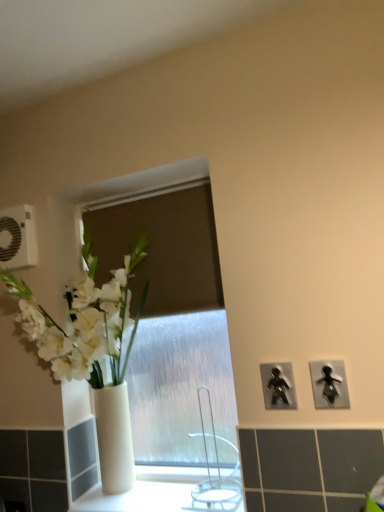
This screenshot has width=384, height=512. Describe the element at coordinates (91, 350) in the screenshot. I see `white glossy vase at left` at that location.

Where is `white glossy vase at left`? Image resolution: width=384 pixels, height=512 pixels. white glossy vase at left is located at coordinates (91, 350).

What do you see at coordinates (329, 384) in the screenshot? The width and height of the screenshot is (384, 512). I see `metallic silver figure at upper right, the second electric outlet from the top` at bounding box center [329, 384].

Image resolution: width=384 pixels, height=512 pixels. In order to click on white glossy vase at left in this screenshot , I will do `click(91, 350)`.

Is silver metallic faucet at center inside or outside of black plastic figure at right, which is the 2th electric outlet in front-to-back order?

silver metallic faucet at center is spatially situated outside black plastic figure at right, which is the 2th electric outlet in front-to-back order.

Considering the sizes of objects silver metallic faucet at center and black plastic figure at right, marked as the second electric outlet in a back-to-front arrangement, in the image provided, who is shorter, silver metallic faucet at center or black plastic figure at right, marked as the second electric outlet in a back-to-front arrangement,?

black plastic figure at right, marked as the second electric outlet in a back-to-front arrangement, is shorter.

Is silver metallic faucet at center not near black plastic figure at right, which is the 2th electric outlet in front-to-back order?

That's not correct — silver metallic faucet at center is a little close to black plastic figure at right, which is the 2th electric outlet in front-to-back order.

From a real-world perspective, which object rests below the other?

silver metallic faucet at center, from a real-world perspective.

From a real-world perspective, is silver metallic faucet at center positioned under white glossy vase at left based on gravity?

Yes, from a real-world perspective, silver metallic faucet at center is beneath white glossy vase at left.

Which of these two, silver metallic faucet at center or white glossy vase at left, stands shorter?

silver metallic faucet at center is shorter.

From the image's perspective, between silver metallic faucet at center and white glossy vase at left, who is located below?

silver metallic faucet at center is shown below in the image.

Can you see silver metallic faucet at center touching white glossy vase at left?

No.

Is metallic silver figure at upper right, marked as the third electric outlet in a left-to-right arrangement, next to silver metallic faucet at center and touching it?

No, metallic silver figure at upper right, marked as the third electric outlet in a left-to-right arrangement, is not beside silver metallic faucet at center.

Considering the points (343, 406) and (213, 437), which point is behind, point (343, 406) or point (213, 437)?

The point (213, 437) is behind.

In the scene shown: From a real-world perspective, is metallic silver figure at upper right, the second electric outlet from the bottom, on top of silver metallic faucet at center?

Yes, from a real-world perspective, metallic silver figure at upper right, the second electric outlet from the bottom, is above silver metallic faucet at center.

From the picture: Does metallic silver figure at upper right, which is the first electric outlet from right to left, have a greater height compared to silver metallic faucet at center?

No.

Is white plastic electric outlet at upper left, which is counted as the 3th electric outlet, starting from the right, aimed at white glossy vase at left?

No, white plastic electric outlet at upper left, which is counted as the 3th electric outlet, starting from the right, is not aimed at white glossy vase at left.

Is white plastic electric outlet at upper left, which is counted as the 1th electric outlet, starting from the top, positioned beyond the bounds of white glossy vase at left?

white plastic electric outlet at upper left, which is counted as the 1th electric outlet, starting from the top, lies outside white glossy vase at left's area.

From a real-world perspective, is white plastic electric outlet at upper left, acting as the third electric outlet starting from the front, physically located above or below white glossy vase at left?

In terms of real-world spatial position, white plastic electric outlet at upper left, acting as the third electric outlet starting from the front, is above white glossy vase at left.

From the picture: Looking at the image, does white plastic electric outlet at upper left, the first electric outlet from the back, seem bigger or smaller compared to white glossy vase at left?

In the image, white plastic electric outlet at upper left, the first electric outlet from the back, appears to be smaller than white glossy vase at left.

The image size is (384, 512). I want to click on houseplant located on the left of silver metallic faucet at center, so click(91, 350).

How many degrees apart are the facing directions of white glossy vase at left and silver metallic faucet at center?

They differ by 0.000612 degrees in their facing directions.

Considering the positions of objects white glossy vase at left and silver metallic faucet at center in the image provided, who is behind, white glossy vase at left or silver metallic faucet at center?

silver metallic faucet at center is behind.

Who is more distant, metallic silver figure at upper right, the second electric outlet from the bottom, or white plastic electric outlet at upper left, the 3th electric outlet from the bottom?

Positioned behind is white plastic electric outlet at upper left, the 3th electric outlet from the bottom.

Can you tell me how much metallic silver figure at upper right, which appears as the first electric outlet when viewed from the front, and white plastic electric outlet at upper left, the 3th electric outlet from the bottom, differ in facing direction?

metallic silver figure at upper right, which appears as the first electric outlet when viewed from the front, and white plastic electric outlet at upper left, the 3th electric outlet from the bottom, are facing 0.00962 degrees away from each other.

From the picture: How distant is metallic silver figure at upper right, the second electric outlet from the top, from white plastic electric outlet at upper left, which is counted as the 3th electric outlet, starting from the right?

metallic silver figure at upper right, the second electric outlet from the top, and white plastic electric outlet at upper left, which is counted as the 3th electric outlet, starting from the right, are 98.51 centimeters apart from each other.

In the scene shown: Can you confirm if metallic silver figure at upper right, the second electric outlet from the top, is smaller than white plastic electric outlet at upper left, which is counted as the 3th electric outlet, starting from the right?

Yes.

From the image's perspective, is black plastic figure at right, marked as the second electric outlet in a back-to-front arrangement, below white plastic electric outlet at upper left, the 3th electric outlet from the bottom?

Yes, from the image's perspective, black plastic figure at right, marked as the second electric outlet in a back-to-front arrangement, is below white plastic electric outlet at upper left, the 3th electric outlet from the bottom.

From a real-world perspective, which is physically below, black plastic figure at right, marked as the second electric outlet in a back-to-front arrangement, or white plastic electric outlet at upper left, arranged as the 1th electric outlet when viewed from the left?

black plastic figure at right, marked as the second electric outlet in a back-to-front arrangement, is physically lower.

Does black plastic figure at right, which is the 2th electric outlet in front-to-back order, have a smaller size compared to white plastic electric outlet at upper left, which is counted as the 3th electric outlet, starting from the right?

Correct, black plastic figure at right, which is the 2th electric outlet in front-to-back order, occupies less space than white plastic electric outlet at upper left, which is counted as the 3th electric outlet, starting from the right.

Is black plastic figure at right, marked as the second electric outlet in a back-to-front arrangement, placed right next to white plastic electric outlet at upper left, arranged as the 1th electric outlet when viewed from the left?

No, black plastic figure at right, marked as the second electric outlet in a back-to-front arrangement, is not next to white plastic electric outlet at upper left, arranged as the 1th electric outlet when viewed from the left.

The image size is (384, 512). I want to click on faucet to the left of black plastic figure at right, marked as the second electric outlet in a back-to-front arrangement, so click(x=214, y=477).

This screenshot has height=512, width=384. What are the coordinates of `faucet below the white glossy vase at left (from a real-world perspective)` in the screenshot? It's located at (214, 477).

From the image, which object appears to be nearer to white glossy vase at left, black plastic figure at right, the 2th electric outlet in the left-to-right sequence, or white plastic electric outlet at upper left, which is counted as the 1th electric outlet, starting from the top?

Based on the image, white plastic electric outlet at upper left, which is counted as the 1th electric outlet, starting from the top, appears to be nearer to white glossy vase at left.

Looking at the image, which one is located further to white plastic electric outlet at upper left, acting as the third electric outlet starting from the front, black plastic figure at right, the third electric outlet positioned from the top, or metallic silver figure at upper right, which appears as the first electric outlet when viewed from the front?

metallic silver figure at upper right, which appears as the first electric outlet when viewed from the front, is positioned further to the anchor white plastic electric outlet at upper left, acting as the third electric outlet starting from the front.

Based on the photo, when comparing their distances from black plastic figure at right, marked as the second electric outlet in a back-to-front arrangement, does white glossy vase at left or white plastic electric outlet at upper left, acting as the third electric outlet starting from the front, seem closer?

Based on the image, white glossy vase at left appears to be nearer to black plastic figure at right, marked as the second electric outlet in a back-to-front arrangement.

Based on their spatial positions, is silver metallic faucet at center or black plastic figure at right, the third electric outlet positioned from the top, further from metallic silver figure at upper right, marked as the third electric outlet in a left-to-right arrangement?

Among the two, silver metallic faucet at center is located further to metallic silver figure at upper right, marked as the third electric outlet in a left-to-right arrangement.

Looking at the image, which one is located closer to white plastic electric outlet at upper left, the first electric outlet from the back, silver metallic faucet at center or white glossy vase at left?

white glossy vase at left is closer to white plastic electric outlet at upper left, the first electric outlet from the back.

From the image, which object appears to be nearer to silver metallic faucet at center, black plastic figure at right, which is the 2th electric outlet in front-to-back order, or white plastic electric outlet at upper left, the first electric outlet from the back?

black plastic figure at right, which is the 2th electric outlet in front-to-back order.

Looking at the image, which one is located closer to metallic silver figure at upper right, which appears as the first electric outlet when viewed from the front, white plastic electric outlet at upper left, which is counted as the 1th electric outlet, starting from the top, or white glossy vase at left?

The object closer to metallic silver figure at upper right, which appears as the first electric outlet when viewed from the front, is white glossy vase at left.

Looking at the image, which one is located further to silver metallic faucet at center, metallic silver figure at upper right, marked as the third electric outlet in a left-to-right arrangement, or black plastic figure at right, the 2th electric outlet when ordered from right to left?

metallic silver figure at upper right, marked as the third electric outlet in a left-to-right arrangement, is positioned further to the anchor silver metallic faucet at center.

Find the location of a particular element. This screenshot has width=384, height=512. faucet between white plastic electric outlet at upper left, acting as the third electric outlet starting from the front, and metallic silver figure at upper right, marked as the third electric outlet in a left-to-right arrangement is located at coordinates (214, 477).

You are a GUI agent. You are given a task and a screenshot of the screen. Output one action in this format:
    pyautogui.click(x=<x>, y=<y>)
    Task: Click on the faucet between white glossy vase at left and metallic silver figure at upper right, acting as the 3th electric outlet starting from the back
    
    Given the screenshot: What is the action you would take?
    pyautogui.click(x=214, y=477)

Image resolution: width=384 pixels, height=512 pixels. In order to click on houseplant between white plastic electric outlet at upper left, which is counted as the 1th electric outlet, starting from the top, and black plastic figure at right, which is the 2th electric outlet in front-to-back order, from left to right in this screenshot , I will do pyautogui.click(x=91, y=350).

The width and height of the screenshot is (384, 512). Identify the location of electric outlet between silver metallic faucet at center and metallic silver figure at upper right, which is the first electric outlet from right to left, in the horizontal direction. (278, 386).